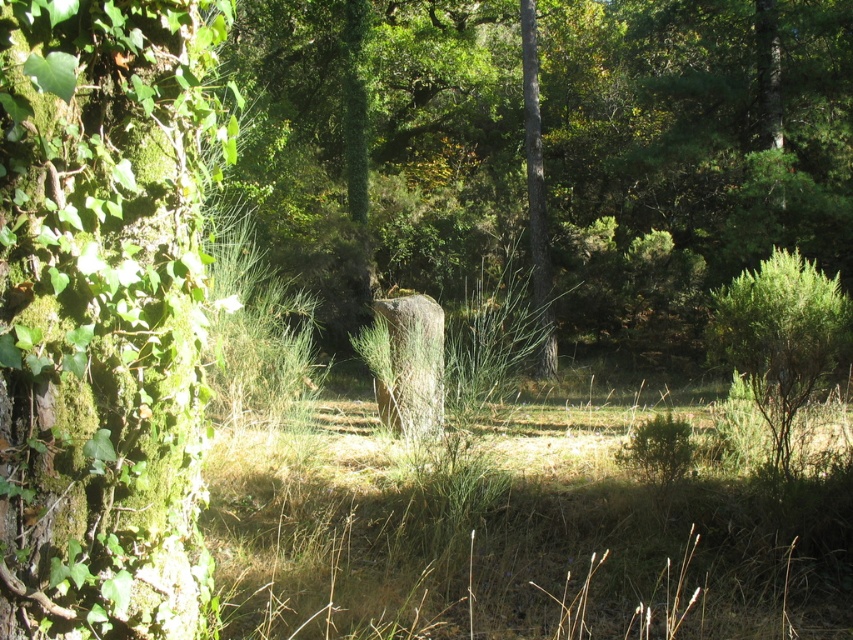
From the picture: You are a hiker trying to cross a forest area. You see a green mossy rock at center and brown dry grass at center. Which object would be more stable to step on?

The green mossy rock at center is larger in size than brown dry grass at center, so stepping on the green mossy rock at center would be more stable since it has a bigger surface area compared to the brown dry grass at center.

You are a hiker who wants to place a small backpack on the ground between the green mossy rock at center and the brown dry grass at center. Which object should you place it closer to so that it stays on top of the ground?

You should place the backpack closer to the brown dry grass at center because the green mossy rock at center is located above the brown dry grass at center, meaning the ground is at the level of the brown dry grass at center.